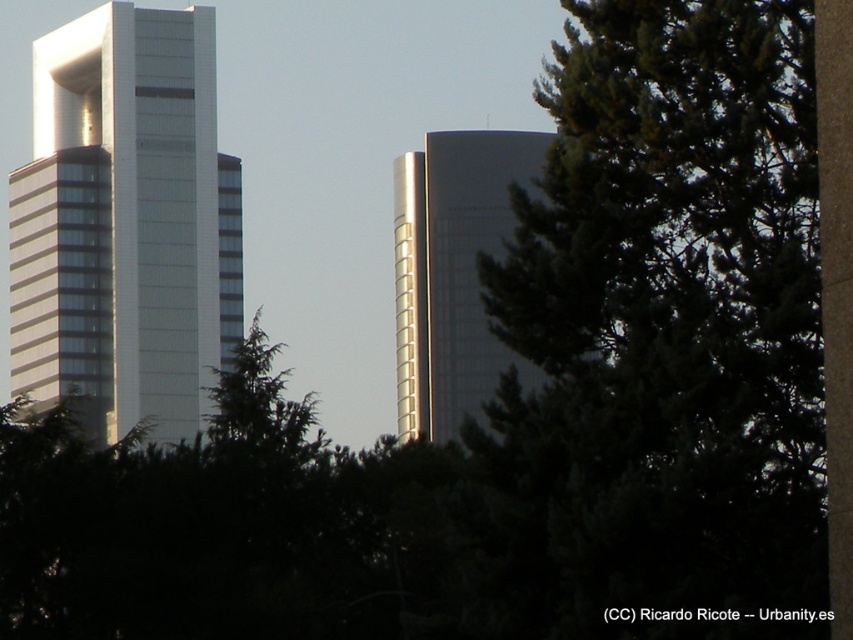
Question: Which of the following is the farthest from the observer?

Choices:
 (A) green textured tree at center
 (B) white glass building at left
 (C) glossy glass tower at center

Answer: (B)

Question: Which of the following is the farthest from the observer?

Choices:
 (A) glossy glass tower at center
 (B) green textured tree at center
 (C) white glass building at left

Answer: (C)

Question: Does white glass building at left appear on the right side of glossy glass tower at center?

Choices:
 (A) no
 (B) yes

Answer: (A)

Question: Can you confirm if white glass building at left is positioned above glossy glass tower at center?

Choices:
 (A) yes
 (B) no

Answer: (A)

Question: Does green textured tree at center come in front of white glass building at left?

Choices:
 (A) no
 (B) yes

Answer: (B)

Question: Which point appears closest to the camera in this image?

Choices:
 (A) (550, 497)
 (B) (457, 180)

Answer: (A)